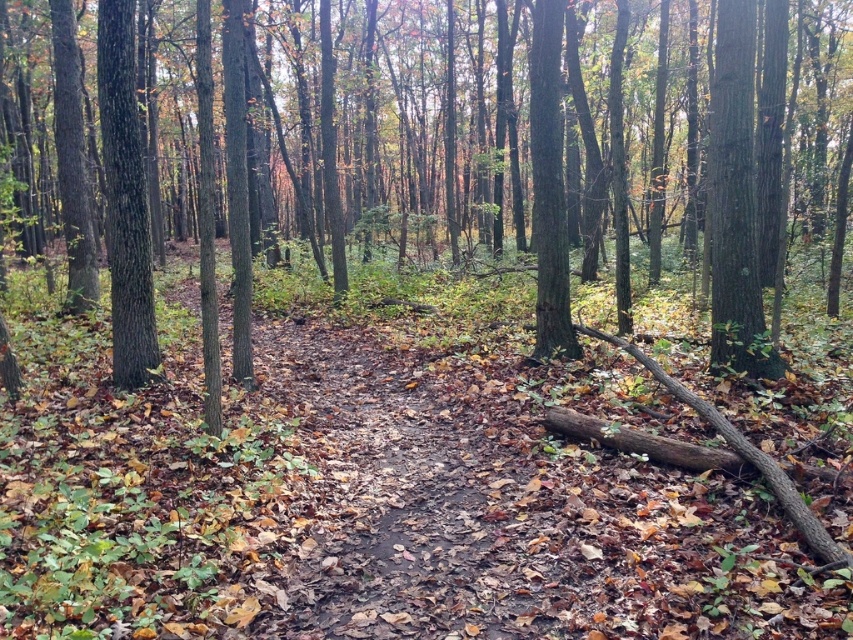
Is brown rough tree at center positioned before smooth brown tree trunk at left?

That is True.

Between brown rough tree at center and smooth brown tree trunk at left, which one appears on the right side from the viewer's perspective?

brown rough tree at center

The image size is (853, 640). I want to click on brown rough tree at center, so click(453, 140).